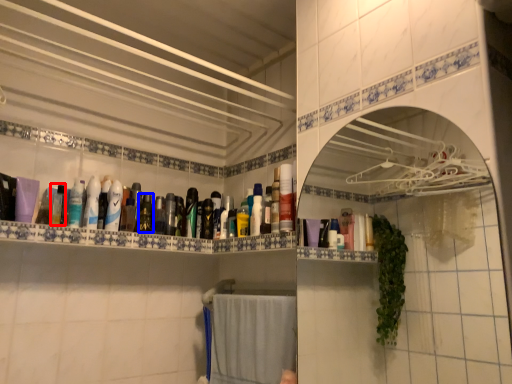
Question: Which of the following is the closest to the observer, mouthwash (highlighted by a red box) or mouthwash (highlighted by a blue box)?

Choices:
 (A) mouthwash
 (B) mouthwash

Answer: (A)